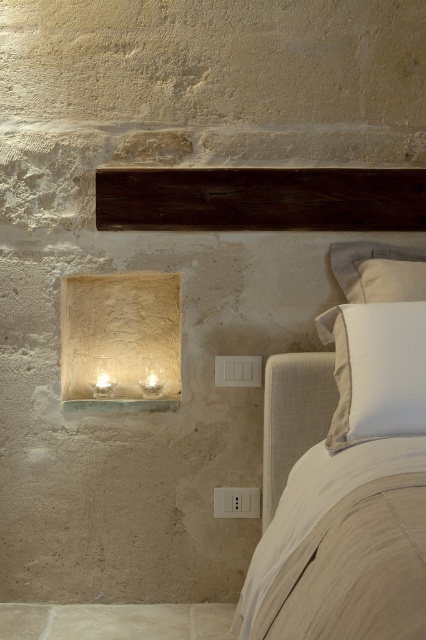
Question: Which object appears closest to the camera in this image?

Choices:
 (A) translucent glass lamp at lower left
 (B) white plastic electric outlet at lower center
 (C) white linen pillow at upper right

Answer: (C)

Question: Is dark wood beam at upper center to the right of white linen pillow at upper right from the viewer's perspective?

Choices:
 (A) no
 (B) yes

Answer: (A)

Question: Which point is closer to the camera?

Choices:
 (A) (344, 429)
 (B) (229, 221)

Answer: (A)

Question: Observing the image, what is the correct spatial positioning of white linen pillow at upper right in reference to translucent glass lamp at lower left?

Choices:
 (A) right
 (B) left

Answer: (A)

Question: Is white linen pillow at upper right thinner than white plastic electric outlet at lower center?

Choices:
 (A) no
 (B) yes

Answer: (A)

Question: Which point is closer to the camera?

Choices:
 (A) (348, 438)
 (B) (161, 392)
 (C) (244, 492)

Answer: (A)